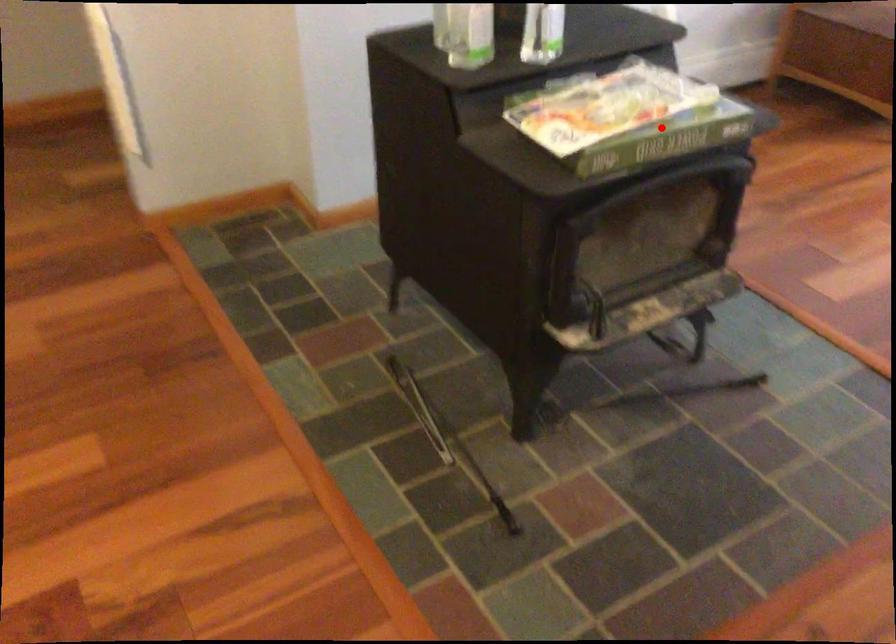
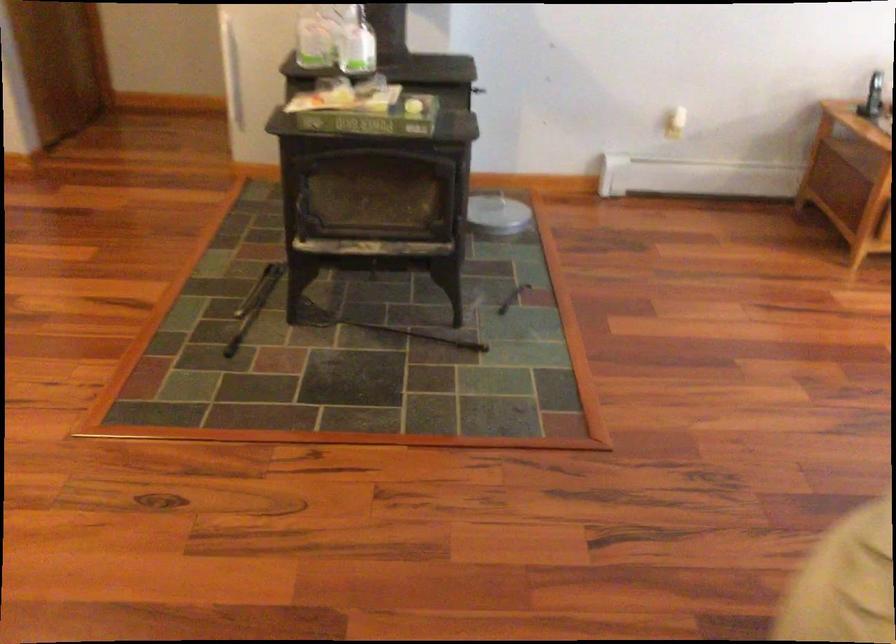
Where in the second image is the point corresponding to the highlighted location from the first image?

(366, 116)